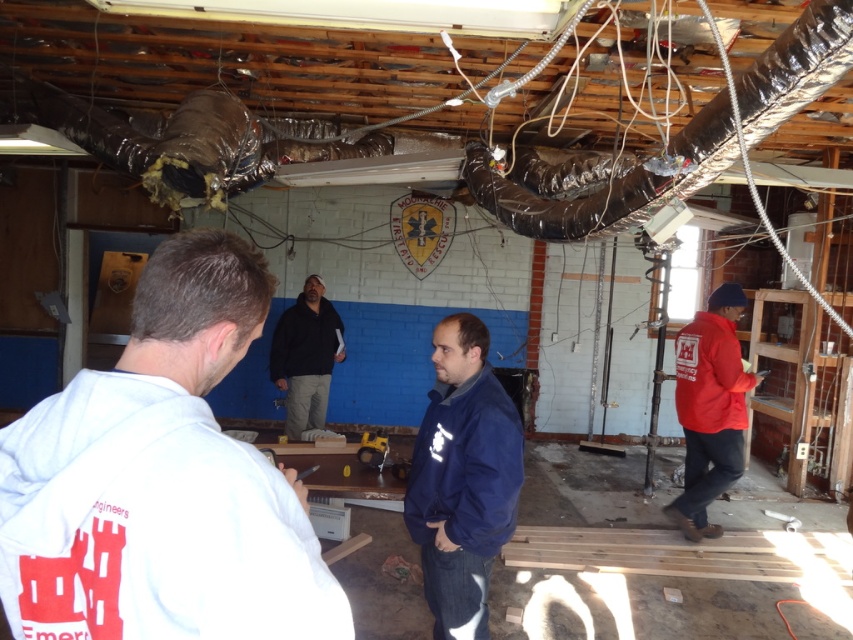
Question: Which object is positioned farthest from the navy blue fleece jacket at center?

Choices:
 (A) black matte jacket at center
 (B) red matte jacket at lower right
 (C) white fleece jacket at upper left
 (D) red fleece jacket at right

Answer: (A)

Question: Is white fleece jacket at upper left to the right of red matte jacket at lower right from the viewer's perspective?

Choices:
 (A) yes
 (B) no

Answer: (B)

Question: Which object is the closest to the red fleece jacket at right?

Choices:
 (A) white fleece jacket at upper left
 (B) navy blue fleece jacket at center

Answer: (B)

Question: Which point appears closest to the camera in this image?

Choices:
 (A) (271, 368)
 (B) (711, 337)
 (C) (30, 563)

Answer: (C)

Question: Is white fleece jacket at upper left thinner than red fleece jacket at right?

Choices:
 (A) yes
 (B) no

Answer: (A)

Question: Does red matte jacket at lower right have a smaller size compared to black matte jacket at center?

Choices:
 (A) yes
 (B) no

Answer: (B)